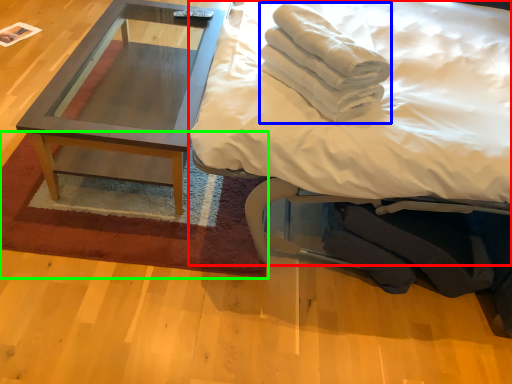
Question: Estimate the real-world distances between objects in this image. Which object is farther from bed (highlighted by a red box), material (highlighted by a blue box) or mat (highlighted by a green box)?

Choices:
 (A) material
 (B) mat

Answer: (B)